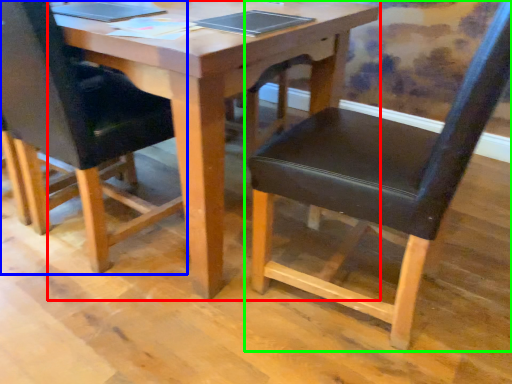
Question: Estimate the real-world distances between objects in this image. Which object is closer to table (highlighted by a red box), chair (highlighted by a blue box) or chair (highlighted by a green box)?

Choices:
 (A) chair
 (B) chair

Answer: (B)